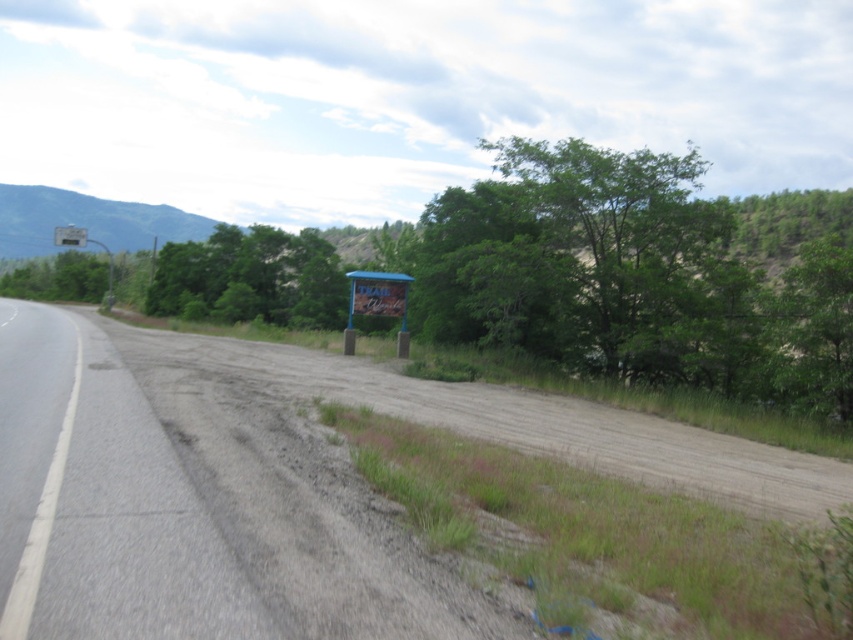
You are driving a car and see the asphalt road at left and the blue plastic sign at center. Which object is closer to the bottom of the image?

The asphalt road at left is positioned under the blue plastic sign at center, so it is closer to the bottom of the image.

You are driving along the road and see the metallic gray sign at upper left and the metallic blue sign at upper center. Which sign is closer to you?

The metallic gray sign at upper left is closer to you because it is in front of the metallic blue sign at upper center.